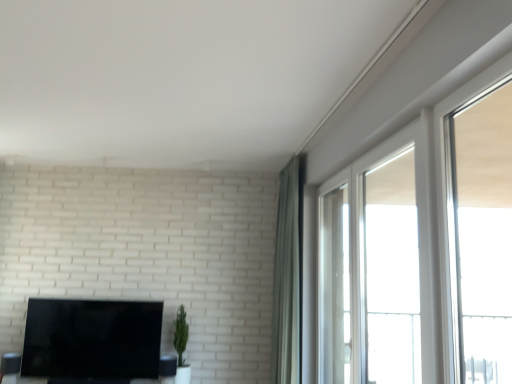
Question: Is clear glass window at upper right, the 2th window viewed from the back, at the right side of green fabric curtain at upper right?

Choices:
 (A) yes
 (B) no

Answer: (A)

Question: Are clear glass window at upper right, the 2th window in the front-to-back sequence, and green fabric curtain at upper right far apart?

Choices:
 (A) no
 (B) yes

Answer: (B)

Question: Considering the relative sizes of clear glass window at upper right, the 2th window in the front-to-back sequence, and green fabric curtain at upper right in the image provided, is clear glass window at upper right, the 2th window in the front-to-back sequence, shorter than green fabric curtain at upper right?

Choices:
 (A) yes
 (B) no

Answer: (A)

Question: Is clear glass window at upper right, the 2th window viewed from the back, at the left side of green fabric curtain at upper right?

Choices:
 (A) no
 (B) yes

Answer: (A)

Question: From the image's perspective, is clear glass window at upper right, the 2th window viewed from the back, under green fabric curtain at upper right?

Choices:
 (A) yes
 (B) no

Answer: (B)

Question: From a real-world perspective, is green matte plant at center positioned above or below clear glass window at right, the first window in the back-to-front sequence?

Choices:
 (A) above
 (B) below

Answer: (B)

Question: Is point (176, 334) closer or farther from the camera than point (375, 273)?

Choices:
 (A) closer
 (B) farther

Answer: (A)

Question: In the image, is green matte plant at center on the left side or the right side of clear glass window at right, positioned as the third window in front-to-back order?

Choices:
 (A) right
 (B) left

Answer: (B)

Question: Is green matte plant at center inside the boundaries of clear glass window at right, the first window in the back-to-front sequence, or outside?

Choices:
 (A) inside
 (B) outside

Answer: (B)

Question: In terms of width, does transparent glass window at right, the 1th window from the front, look wider or thinner when compared to clear glass window at upper right, the 2th window viewed from the back?

Choices:
 (A) thin
 (B) wide

Answer: (B)

Question: Is transparent glass window at right, the third window from the back, to the left or to the right of clear glass window at upper right, the 2th window in the front-to-back sequence, in the image?

Choices:
 (A) left
 (B) right

Answer: (B)

Question: Is transparent glass window at right, the third window from the back, bigger or smaller than clear glass window at upper right, the 2th window in the front-to-back sequence?

Choices:
 (A) big
 (B) small

Answer: (B)

Question: Is transparent glass window at right, the 1th window from the front, taller or shorter than clear glass window at upper right, the 2th window viewed from the back?

Choices:
 (A) short
 (B) tall

Answer: (A)

Question: Considering the positions of black glossy tv at lower left and clear glass window at upper right, the 2th window in the front-to-back sequence, in the image, is black glossy tv at lower left taller or shorter than clear glass window at upper right, the 2th window in the front-to-back sequence,?

Choices:
 (A) short
 (B) tall

Answer: (A)

Question: Is black glossy tv at lower left to the left or to the right of clear glass window at upper right, the 2th window viewed from the back, in the image?

Choices:
 (A) left
 (B) right

Answer: (A)